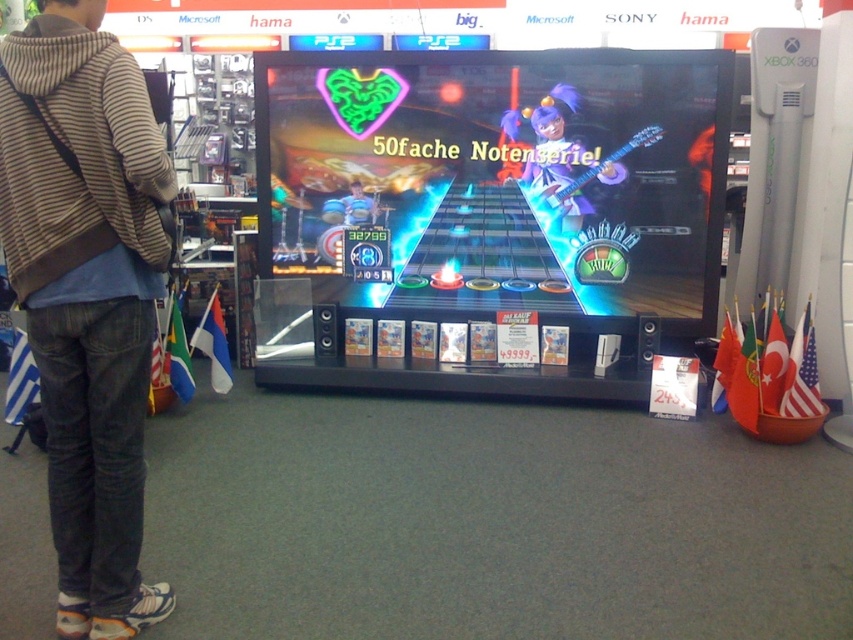
Question: Among these points, which one is nearest to the camera?

Choices:
 (A) (64, 300)
 (B) (579, 204)
 (C) (474, 140)
 (D) (358, 198)

Answer: (A)

Question: Does shiny plastic guitar at center have a larger size compared to blue denim jeans at center?

Choices:
 (A) no
 (B) yes

Answer: (B)

Question: Can you confirm if purple hair at center is positioned above blue denim jeans at center?

Choices:
 (A) no
 (B) yes

Answer: (B)

Question: Among these points, which one is nearest to the camera?

Choices:
 (A) 573,195
 (B) 55,397
 (C) 550,275

Answer: (B)

Question: Can you confirm if striped hoodie at center is wider than purple hair at center?

Choices:
 (A) yes
 (B) no

Answer: (B)

Question: Which of the following is the farthest from the observer?

Choices:
 (A) (375, 195)
 (B) (572, 214)
 (C) (32, 323)
 (D) (323, 108)

Answer: (A)